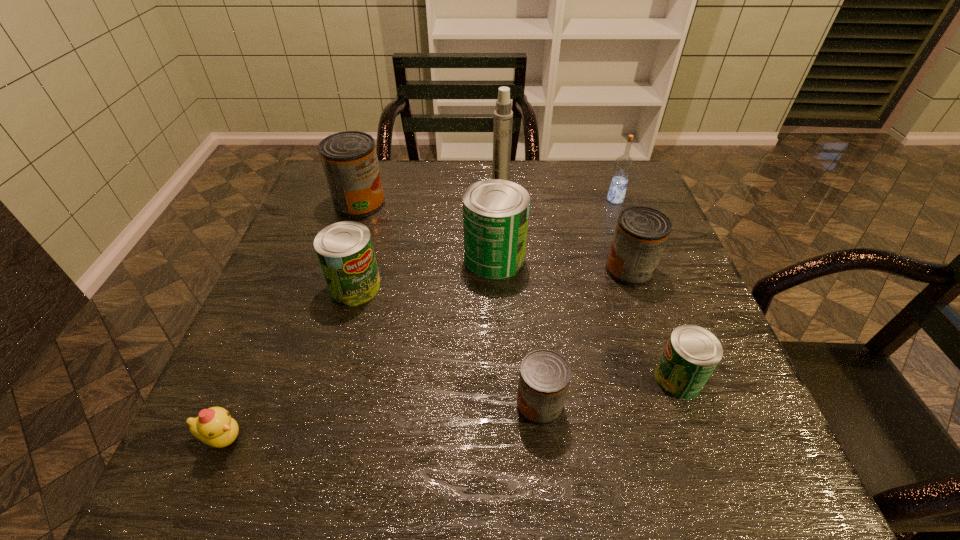
Image resolution: width=960 pixels, height=540 pixels. I want to click on object that is at the near left corner, so click(214, 426).

This screenshot has width=960, height=540. I want to click on object positioned at the far right corner, so click(623, 166).

You are a GUI agent. You are given a task and a screenshot of the screen. Output one action in this format:
    pyautogui.click(x=<x>, y=<y>)
    Task: Click on the vacant region at the far edge
    
    Given the screenshot: What is the action you would take?
    pyautogui.click(x=563, y=186)

Where is `vacant region at the near edge of the desktop`? Image resolution: width=960 pixels, height=540 pixels. vacant region at the near edge of the desktop is located at coordinates (557, 481).

Identify the location of free space at the left edge. (294, 346).

This screenshot has height=540, width=960. I want to click on free space at the right edge of the desktop, so click(668, 263).

You are a GUI agent. You are given a task and a screenshot of the screen. Output one action in this format:
    pyautogui.click(x=<x>, y=<y>)
    Task: Click on the free space at the far right corner of the desktop
    
    Given the screenshot: What is the action you would take?
    pyautogui.click(x=593, y=166)

The image size is (960, 540). What are the coordinates of `vacant point located between the blue vodka and the tallest object` in the screenshot? It's located at (558, 194).

Where is `free spot between the biggest green can and the nearest green can`? This screenshot has height=540, width=960. free spot between the biggest green can and the nearest green can is located at coordinates (586, 319).

Locate an element on the screen. free space between the rightmost green can and the second green can from left to right is located at coordinates (586, 319).